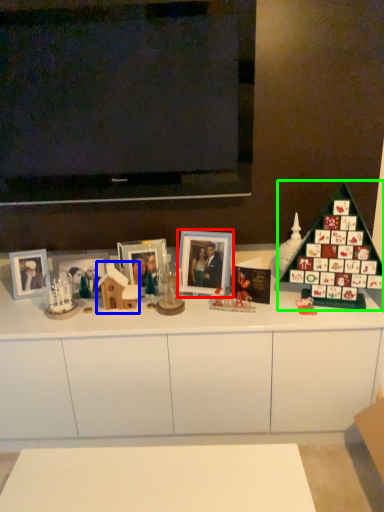
Question: Which object is the closest to the picture frame (highlighted by a red box)? Choose among these: toy (highlighted by a blue box) or christmas tree (highlighted by a green box).

Choices:
 (A) toy
 (B) christmas tree

Answer: (A)